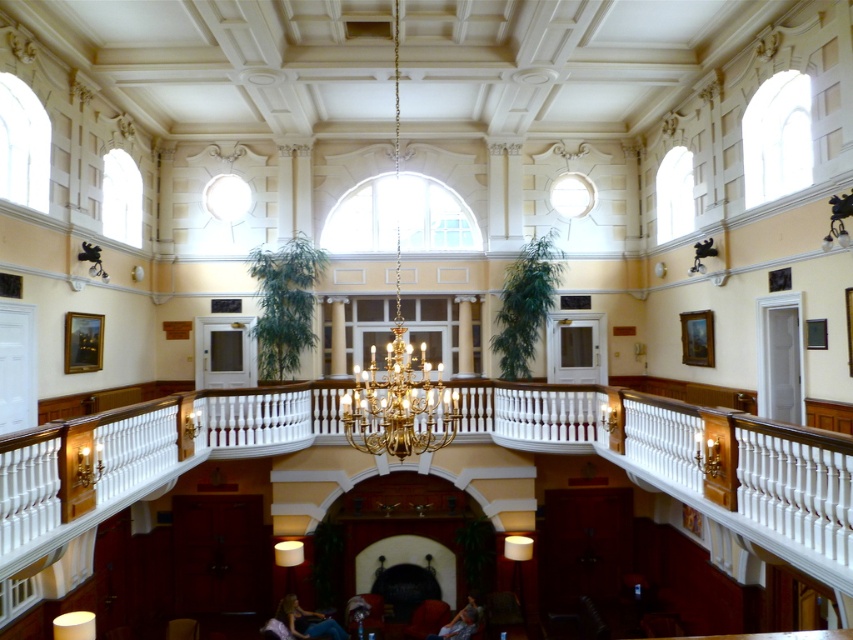
You are standing at the entrance of the grand hall and want to greet the blue fabric person at lower center. According to the image, where should you walk to find them?

The blue fabric person at lower center is located at point (306, 620), so you should walk towards the lower center area of the grand hall to find them.

You are standing in the grand hall and want to take a photo of the blue fabric person at lower center without the gold metallic chandelier at center appearing in the background. Is this possible?

The gold metallic chandelier at center is located above the blue fabric person at lower center, so if you position yourself directly in front of the blue fabric person at lower center and angle the camera downward, you can avoid capturing the chandelier in the background.